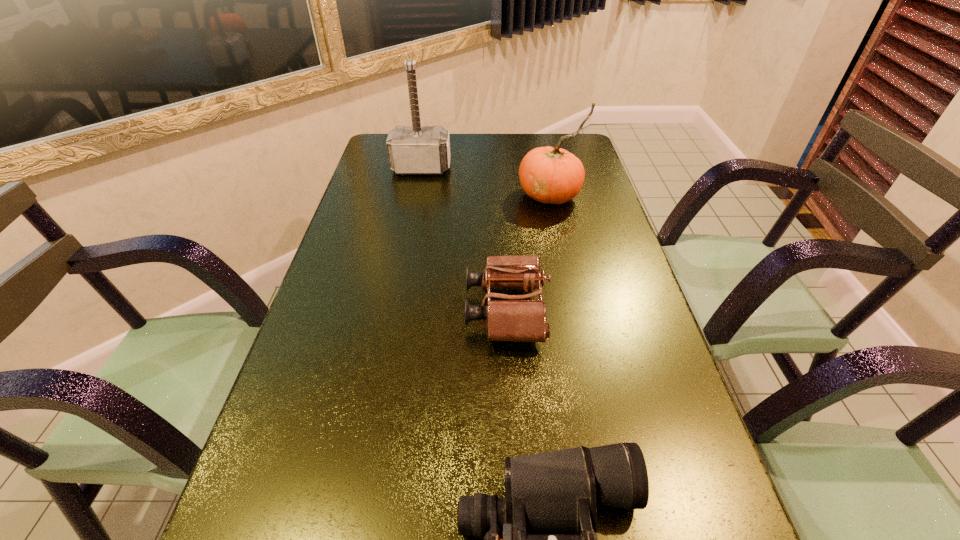
You are a GUI agent. You are given a task and a screenshot of the screen. Output one action in this format:
    pyautogui.click(x=<x>, y=<y>)
    Task: Click on the free area in between the farthest object and the taller binoculars
    Image resolution: width=960 pixels, height=540 pixels.
    Given the screenshot: What is the action you would take?
    pyautogui.click(x=464, y=239)

In order to click on free spot between the second farthest object and the second shortest object in this screenshot , I will do `click(528, 253)`.

Identify the location of empty location between the second nearest object and the pumpkin. The image size is (960, 540). (528, 253).

This screenshot has height=540, width=960. What are the coordinates of `free space between the pumpkin and the hammer` in the screenshot? It's located at (486, 181).

The width and height of the screenshot is (960, 540). I want to click on unoccupied position between the hammer and the pumpkin, so click(486, 181).

Locate an element on the screen. The image size is (960, 540). free space between the leftmost object and the taller binoculars is located at coordinates (464, 239).

Select which object is the closest to the nearer binoculars. Please provide its 2D coordinates. Your answer should be formatted as a tuple, i.e. [(x, y)], where the tuple contains the x and y coordinates of a point satisfying the conditions above.

[(515, 319)]

Where is `object that stands as the closest to the shorter binoculars`? object that stands as the closest to the shorter binoculars is located at coordinates (515, 319).

Identify the location of vacant space that satisfies the following two spatial constraints: 1. for striking with the head of the pumpkin; 2. on the right side of the tallest object. (416, 195).

Where is `vacant point that satisfies the following two spatial constraints: 1. for striking with the head of the third nearest object; 2. on the left side of the hammer`? Image resolution: width=960 pixels, height=540 pixels. vacant point that satisfies the following two spatial constraints: 1. for striking with the head of the third nearest object; 2. on the left side of the hammer is located at coordinates (416, 195).